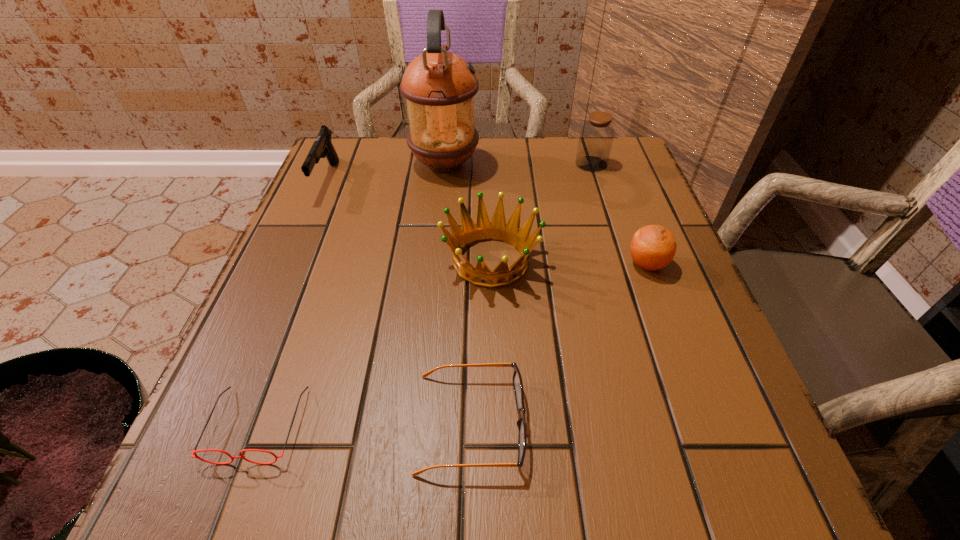
Where is `unoccupied position between the crown and the sixth shortest object`? This screenshot has height=540, width=960. unoccupied position between the crown and the sixth shortest object is located at coordinates (541, 212).

Find the location of `vacant area between the jar and the left spectacles`. vacant area between the jar and the left spectacles is located at coordinates (424, 294).

Where is `unoccupied position between the gun and the left spectacles`? unoccupied position between the gun and the left spectacles is located at coordinates (293, 302).

Where is `free point between the tallest object and the orange`? free point between the tallest object and the orange is located at coordinates click(x=545, y=214).

Locate an element on the screen. The width and height of the screenshot is (960, 540). vacant region between the tallest object and the orange is located at coordinates (545, 214).

The height and width of the screenshot is (540, 960). What are the coordinates of `vacant area that lies between the right spectacles and the orange` in the screenshot? It's located at (559, 343).

In order to click on vacant space that is in between the right spectacles and the jar in this screenshot , I will do `click(531, 293)`.

The height and width of the screenshot is (540, 960). What are the coordinates of `vacant space that's between the gun and the left spectacles` in the screenshot? It's located at (293, 302).

Locate which object ranks fifth in proximity to the right spectacles. Please provide its 2D coordinates. Your answer should be formatted as a tuple, i.e. [(x, y)], where the tuple contains the x and y coordinates of a point satisfying the conditions above.

[(439, 86)]

The width and height of the screenshot is (960, 540). In order to click on the fourth closest object to the left spectacles in this screenshot , I will do `click(439, 86)`.